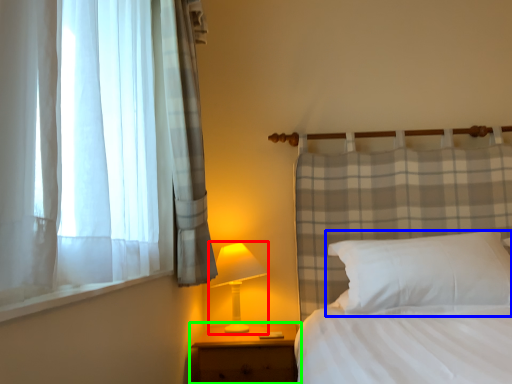
Question: Which object is the closest to the table lamp (highlighted by a red box)? Choose among these: pillow (highlighted by a blue box) or nightstand (highlighted by a green box).

Choices:
 (A) pillow
 (B) nightstand

Answer: (B)